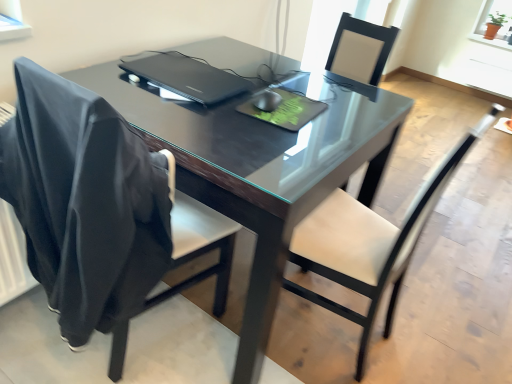
Find the location of a particular element. This screenshot has height=384, width=512. vacant area that is situated to the right of white leather chair at center, which is the 1th chair from right to left is located at coordinates (432, 325).